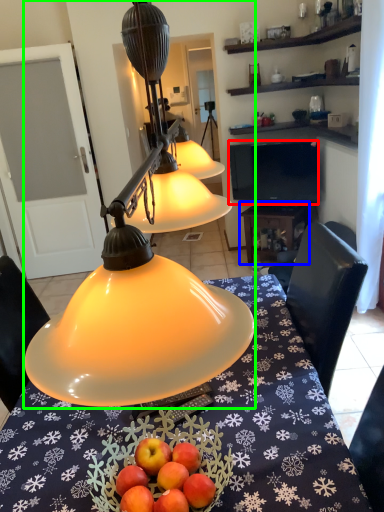
Question: Which object is the closest to the television (highlighted by a red box)? Choose among these: table (highlighted by a blue box) or lamp (highlighted by a green box).

Choices:
 (A) table
 (B) lamp

Answer: (A)